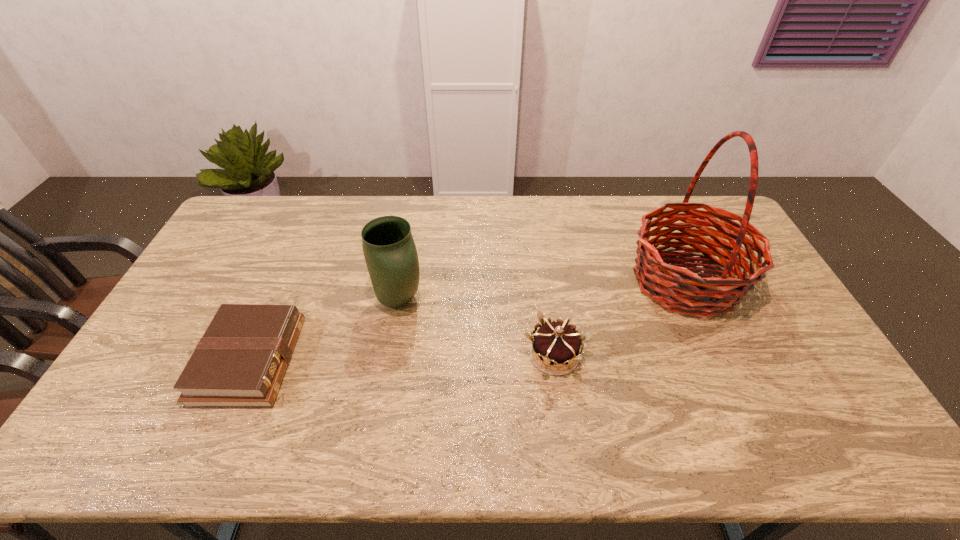
Where is `free space between the shortest object and the third object from left to right`? This screenshot has height=540, width=960. free space between the shortest object and the third object from left to right is located at coordinates (402, 358).

In order to click on free space between the vase and the shortest object in this screenshot , I will do tap(324, 330).

Where is `vacant area that lies between the second tallest object and the Bible`? vacant area that lies between the second tallest object and the Bible is located at coordinates (324, 330).

You are a GUI agent. You are given a task and a screenshot of the screen. Output one action in this format:
    pyautogui.click(x=<x>, y=<y>)
    Task: Click on the free spot between the shortest object and the third tallest object
    The image size is (960, 540).
    Given the screenshot: What is the action you would take?
    pyautogui.click(x=402, y=358)

Identify the location of free space that is in between the Bible and the third object from right to left. The width and height of the screenshot is (960, 540). point(324,330).

The width and height of the screenshot is (960, 540). I want to click on vacant area that lies between the Bible and the tallest object, so click(468, 321).

The width and height of the screenshot is (960, 540). What are the coordinates of `empty space between the Bible and the second object from left to right` in the screenshot? It's located at (324, 330).

I want to click on free space between the third shortest object and the leftmost object, so click(324, 330).

Where is `free space between the third object from left to right and the tallest object`? This screenshot has width=960, height=540. free space between the third object from left to right and the tallest object is located at coordinates (620, 319).

Choose which object is the nearest neighbor to the basket. Please provide its 2D coordinates. Your answer should be formatted as a tuple, i.e. [(x, y)], where the tuple contains the x and y coordinates of a point satisfying the conditions above.

[(556, 343)]